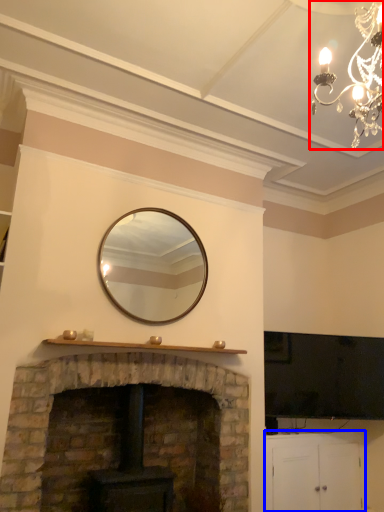
Question: Which object appears farthest to the camera in this image, lamp (highlighted by a red box) or cabinetry (highlighted by a blue box)?

Choices:
 (A) lamp
 (B) cabinetry

Answer: (B)